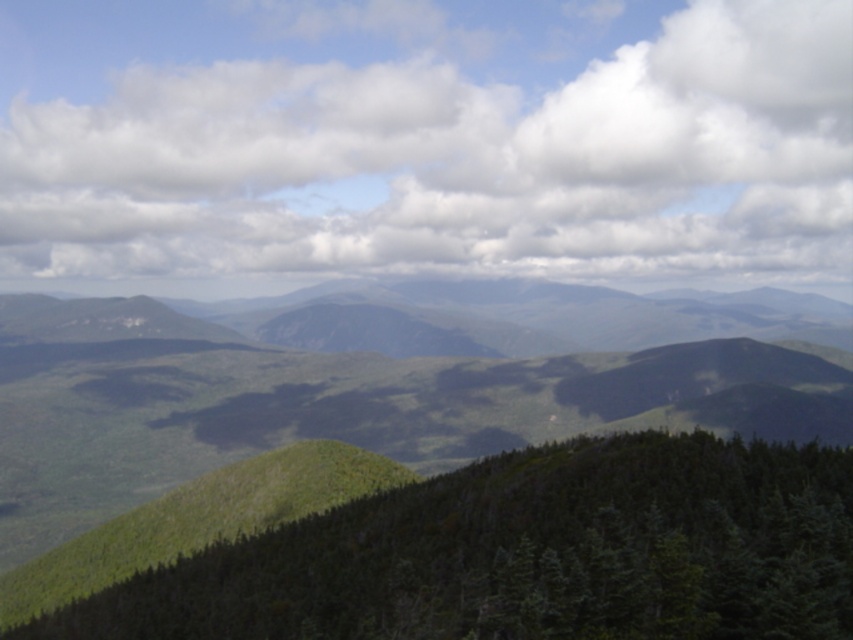
Identify the location of white fluffy cloud at upper center. (424, 145).

Does white fluffy cloud at upper center have a smaller size compared to green matte tree at center?

No.

Does point (329, 177) come in front of point (598, 612)?

That is False.

Where is `white fluffy cloud at upper center`? white fluffy cloud at upper center is located at coordinates (424, 145).